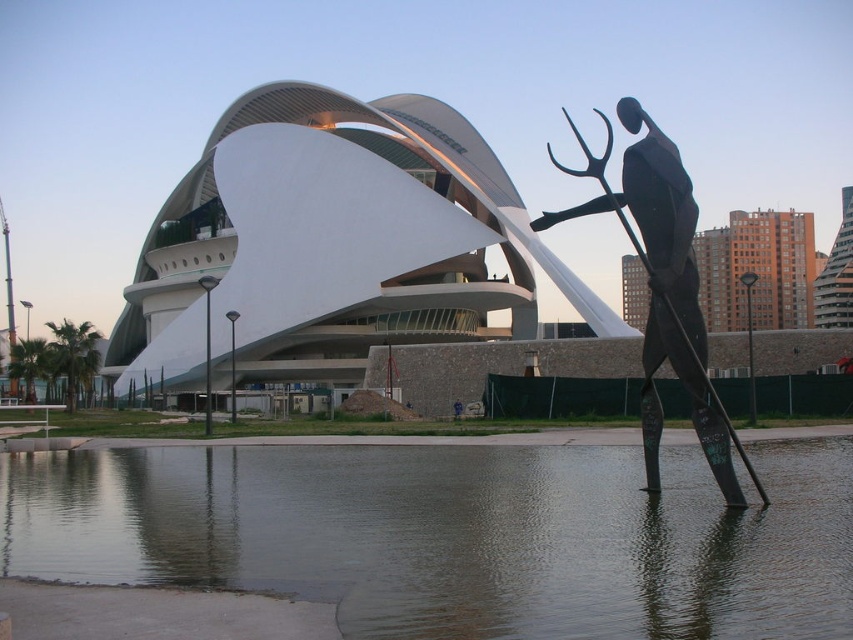
You are a visitor at the urban landscape and want to take a photo of the clear water at lower center and the black metal trident at right. Which object is shorter in height?

The clear water at lower center is not as tall as the black metal trident at right, so the clear water at lower center is shorter in height.

You are a visitor at the urban landscape and want to take a photo of the clear water at lower center and black metal trident at right. Which object should you focus on first to ensure both are in frame?

You should focus on the clear water at lower center first because it is in front of the black metal trident at right, so positioning your camera to include both would require framing starting from the front object.

You are a visitor at this urban landscape and want to take a photo of the clear water at lower center without the black metal trident at right blocking the view. Is there a way to do this by moving to the left side?

The clear water at lower center is positioned under the black metal trident at right, so moving to the left side might allow you to position yourself where the trident is no longer blocking the view of the water.